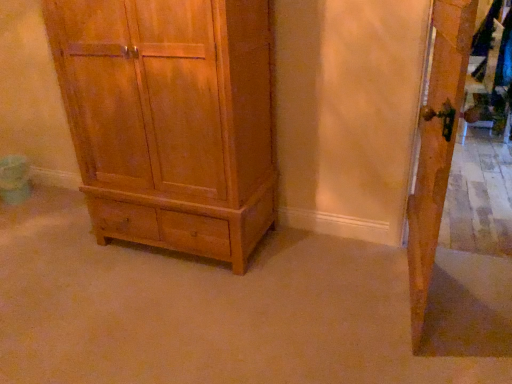
Question: From a real-world perspective, is matte wood chest of drawers at center below wooden door at right?

Choices:
 (A) no
 (B) yes

Answer: (A)

Question: Can you confirm if matte wood chest of drawers at center is shorter than wooden door at right?

Choices:
 (A) no
 (B) yes

Answer: (A)

Question: Would you say matte wood chest of drawers at center is a long distance from wooden door at right?

Choices:
 (A) no
 (B) yes

Answer: (B)

Question: Is matte wood chest of drawers at center next to wooden door at right and touching it?

Choices:
 (A) no
 (B) yes

Answer: (A)

Question: Is matte wood chest of drawers at center in front of wooden door at right?

Choices:
 (A) no
 (B) yes

Answer: (A)

Question: Considering the relative sizes of matte wood chest of drawers at center and wooden door at right in the image provided, is matte wood chest of drawers at center wider than wooden door at right?

Choices:
 (A) yes
 (B) no

Answer: (A)

Question: Does wooden door at right have a greater width compared to matte wood chest of drawers at center?

Choices:
 (A) yes
 (B) no

Answer: (B)

Question: From the image's perspective, is wooden door at right located beneath matte wood chest of drawers at center?

Choices:
 (A) yes
 (B) no

Answer: (A)

Question: Can we say wooden door at right lies outside matte wood chest of drawers at center?

Choices:
 (A) no
 (B) yes

Answer: (B)

Question: Is wooden door at right closer to the viewer compared to matte wood chest of drawers at center?

Choices:
 (A) yes
 (B) no

Answer: (A)

Question: Does wooden door at right turn towards matte wood chest of drawers at center?

Choices:
 (A) yes
 (B) no

Answer: (A)

Question: From a real-world perspective, does wooden door at right sit lower than matte wood chest of drawers at center?

Choices:
 (A) no
 (B) yes

Answer: (B)

Question: From the image's perspective, is matte wood chest of drawers at center above or below wooden door at right?

Choices:
 (A) below
 (B) above

Answer: (B)